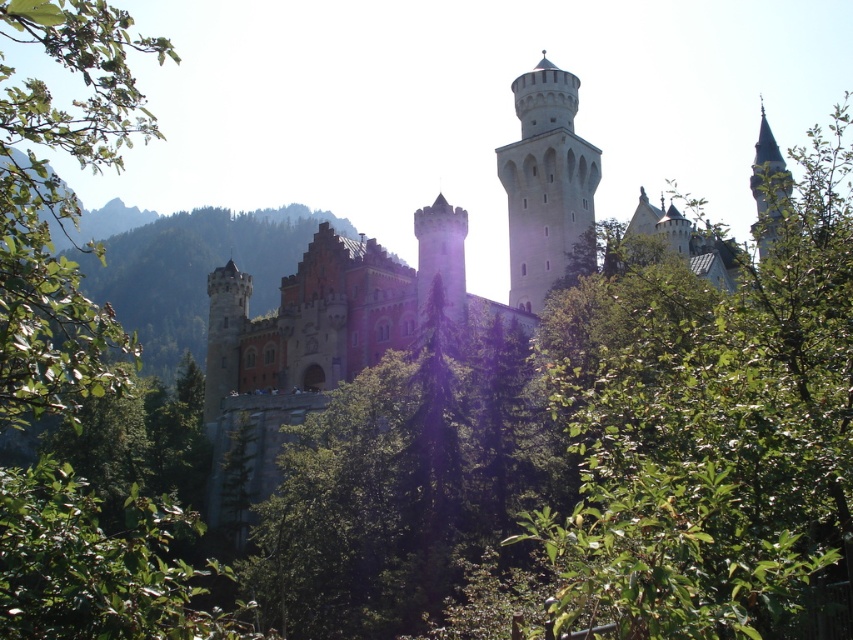
Is green leafy tree at left positioned in front of smooth stone tower at center?

That is True.

Who is positioned more to the left, green leafy tree at left or smooth stone tower at center?

green leafy tree at left is more to the left.

Which is in front, point (138, 45) or point (454, 221)?

Point (454, 221)

This screenshot has height=640, width=853. In order to click on green leafy tree at left in this screenshot , I will do `click(61, 204)`.

Is point (451, 310) positioned behind point (759, 253)?

That is False.

Between smooth stone tower at center and white stone tower at upper right, which one has less height?

smooth stone tower at center is shorter.

Is point (454, 307) farther from camera compared to point (756, 170)?

No, (454, 307) is in front of (756, 170).

At what (x,y) coordinates should I click in order to perform the action: click on smooth stone tower at center. Please return your answer as a coordinate pair (x, y). The height and width of the screenshot is (640, 853). Looking at the image, I should click on (440, 275).

Does white stone tower at upper center appear under smooth stone tower at center?

Actually, white stone tower at upper center is above smooth stone tower at center.

Find the location of a particular element. white stone tower at upper center is located at coordinates (544, 182).